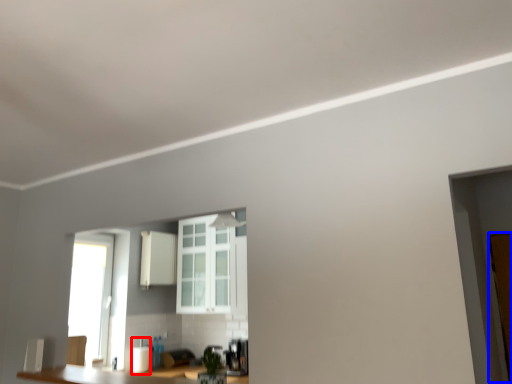
Question: Among these objects, which one is nearest to the camera, appliance (highlighted by a red box) or door (highlighted by a blue box)?

Choices:
 (A) appliance
 (B) door

Answer: (B)